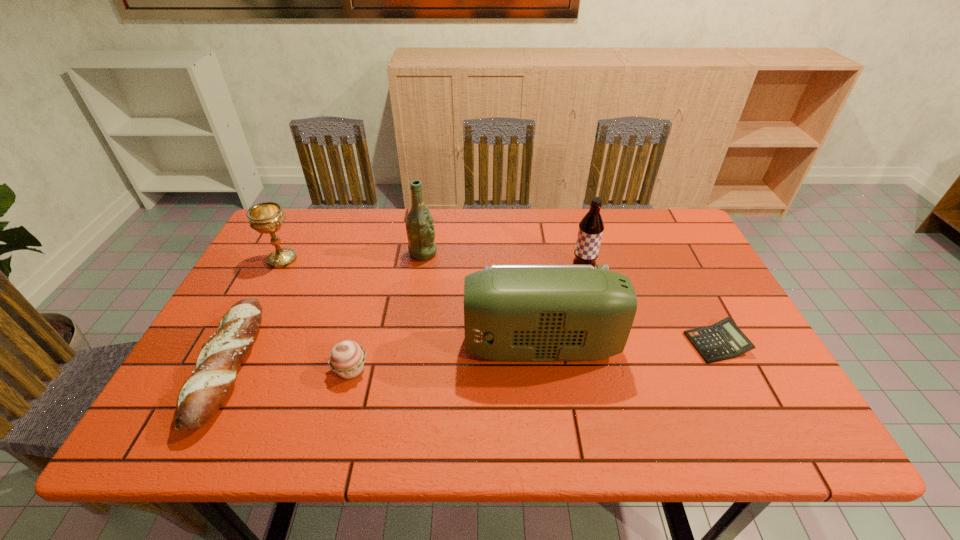
At what (x,y) coordinates should I click in order to perform the action: click on free location that satisfies the following two spatial constraints: 1. on the front side of the root beer; 2. on the left side of the shortest object. Please return your answer as a coordinate pair (x, y). The width and height of the screenshot is (960, 540). Looking at the image, I should click on (602, 343).